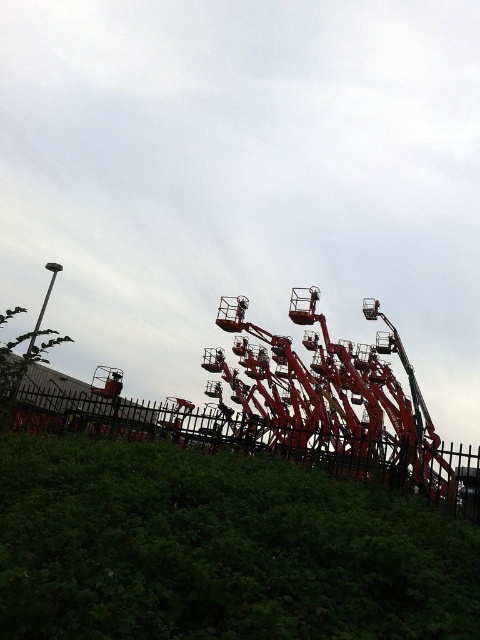
Question: Is metallic orange amusement park ride at center in front of metallic red amusement ride at center?

Choices:
 (A) no
 (B) yes

Answer: (B)

Question: Among these points, which one is farthest from the camera?

Choices:
 (A) (351, 408)
 (B) (414, 500)

Answer: (A)

Question: Considering the relative positions of metallic orange amusement park ride at center and metallic red amusement ride at center in the image provided, where is metallic orange amusement park ride at center located with respect to metallic red amusement ride at center?

Choices:
 (A) below
 (B) above

Answer: (B)

Question: Can you confirm if metallic orange amusement park ride at center is wider than metallic red amusement ride at center?

Choices:
 (A) no
 (B) yes

Answer: (B)